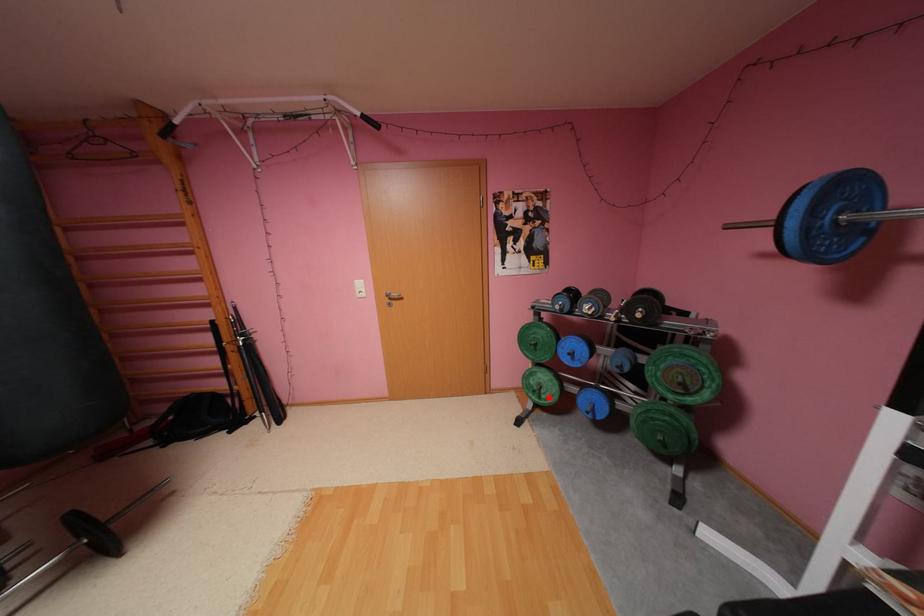
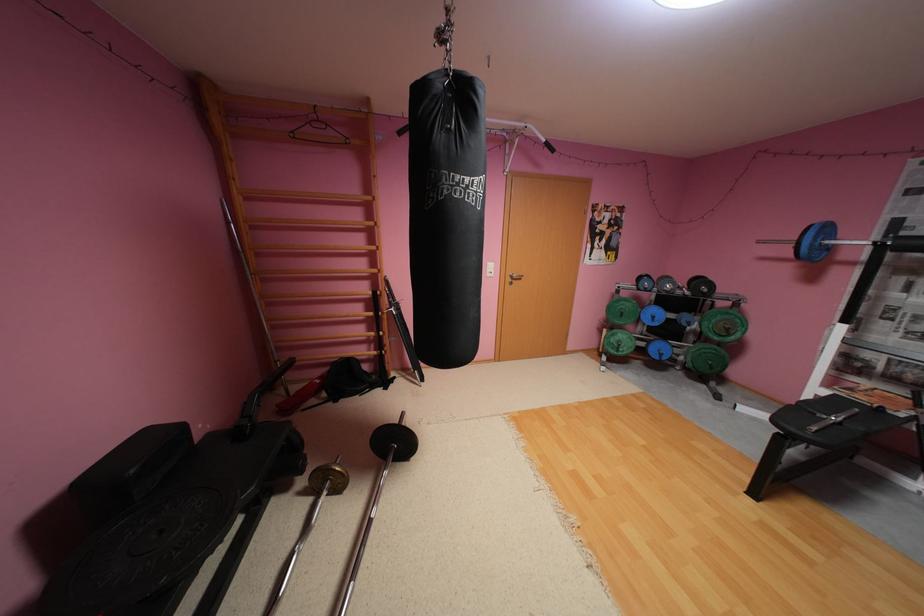
The point at the highlighted location is marked in the first image. Where is the corresponding point in the second image?

(626, 351)